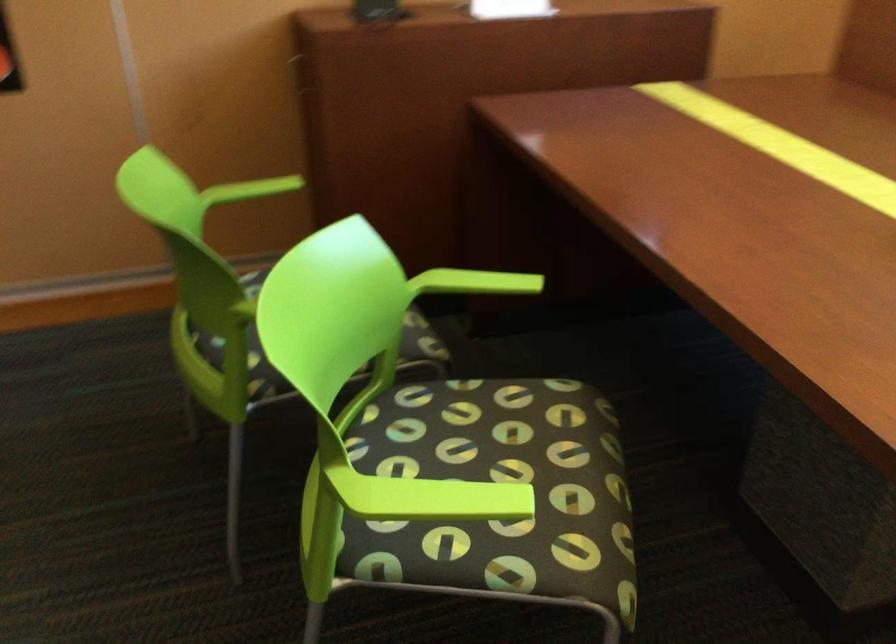
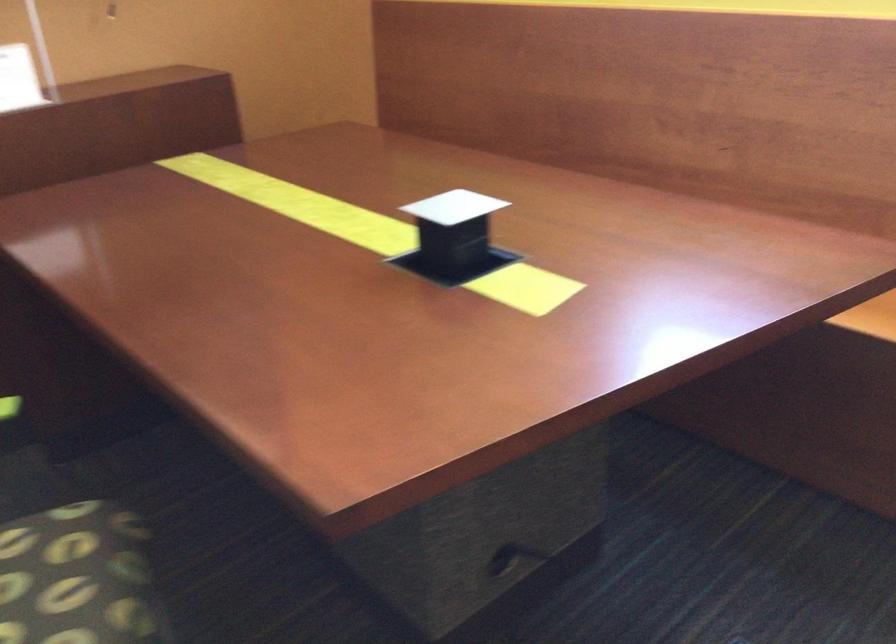
Question: The first image is from the beginning of the video and the second image is from the end. How did the camera likely rotate when shooting the video?

Choices:
 (A) Left
 (B) Right
 (C) Up
 (D) Down

Answer: (B)